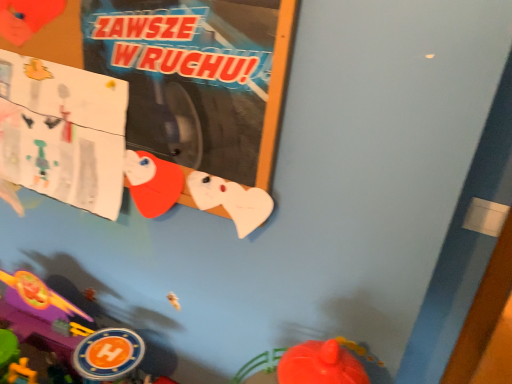
Question: From a real-world perspective, is white paper at upper left over smooth plastic toy at lower left?

Choices:
 (A) no
 (B) yes

Answer: (B)

Question: Could smooth plastic toy at lower left be considered to be inside white paper at upper left?

Choices:
 (A) yes
 (B) no

Answer: (B)

Question: Is white paper at upper left in contact with smooth plastic toy at lower left?

Choices:
 (A) yes
 (B) no

Answer: (B)

Question: Is white paper at upper left positioned beyond the bounds of smooth plastic toy at lower left?

Choices:
 (A) no
 (B) yes

Answer: (B)

Question: From a real-world perspective, does white paper at upper left sit lower than smooth plastic toy at lower left?

Choices:
 (A) yes
 (B) no

Answer: (B)

Question: From the image's perspective, is white paper at upper left under smooth plastic toy at lower left?

Choices:
 (A) yes
 (B) no

Answer: (B)

Question: Is smooth plastic toy at lower left at the right side of white paper at upper left?

Choices:
 (A) no
 (B) yes

Answer: (A)

Question: Could you tell me if smooth plastic toy at lower left is turned towards white paper at upper left?

Choices:
 (A) yes
 (B) no

Answer: (B)

Question: Is smooth plastic toy at lower left at the left side of white paper at upper left?

Choices:
 (A) yes
 (B) no

Answer: (A)

Question: From the image's perspective, is smooth plastic toy at lower left over white paper at upper left?

Choices:
 (A) no
 (B) yes

Answer: (A)

Question: Can you see smooth plastic toy at lower left touching white paper at upper left?

Choices:
 (A) yes
 (B) no

Answer: (B)

Question: Can you confirm if smooth plastic toy at lower left is thinner than white paper at upper left?

Choices:
 (A) no
 (B) yes

Answer: (A)

Question: From the image's perspective, is white paper at upper left positioned above or below smooth plastic toy at lower left?

Choices:
 (A) below
 (B) above

Answer: (B)